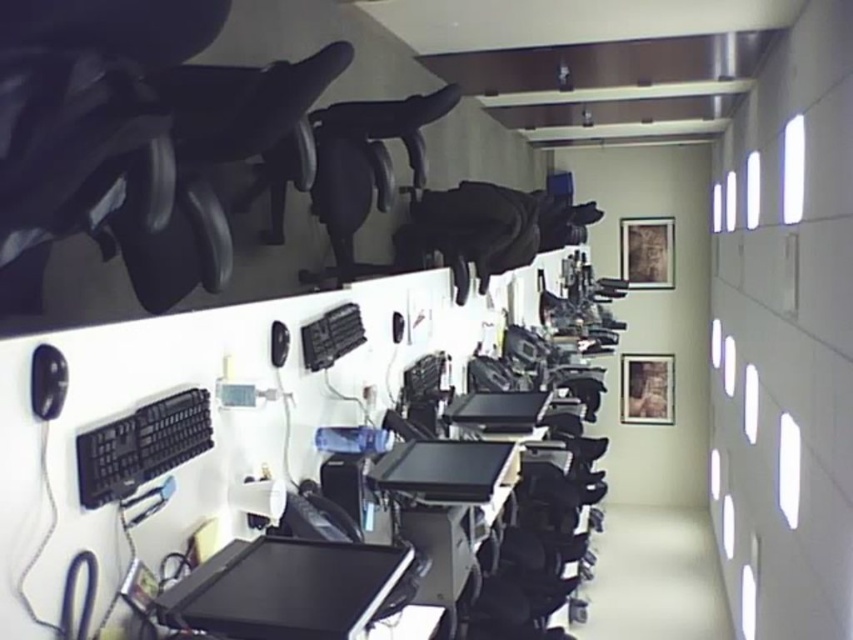
Is black matte monitor at center in front of black plastic keyboard at lower left?

No, black matte monitor at center is behind black plastic keyboard at lower left.

Measure the distance between black matte monitor at center and camera.

black matte monitor at center is 4.09 feet from camera.

Is point (341, 563) more distant than point (78, 454)?

That is True.

The width and height of the screenshot is (853, 640). I want to click on black matte monitor at center, so click(283, 588).